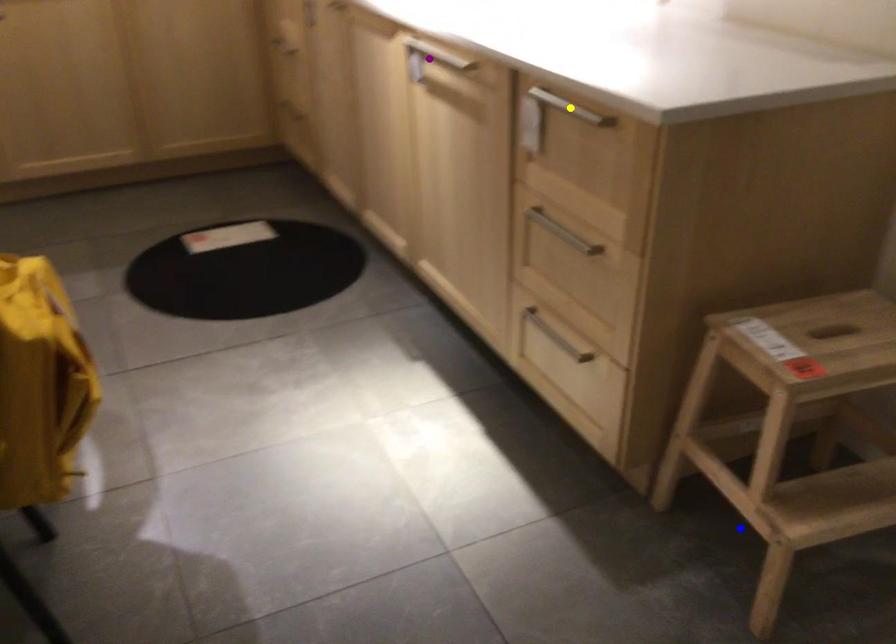
Order these from nearest to farthest:
- blue point
- purple point
- yellow point

yellow point → blue point → purple point